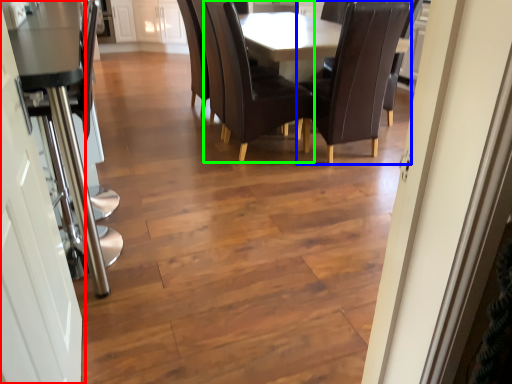
Question: Estimate the real-world distances between objects in this image. Which object is farther from door (highlighted by a red box), chair (highlighted by a blue box) or chair (highlighted by a green box)?

Choices:
 (A) chair
 (B) chair

Answer: (A)